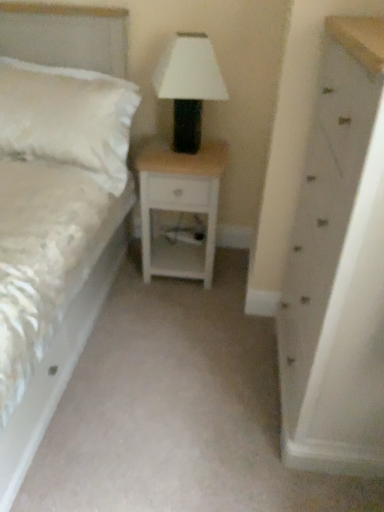
What are the coordinates of `free location in front of white wood nightstand at center` in the screenshot? It's located at (184, 308).